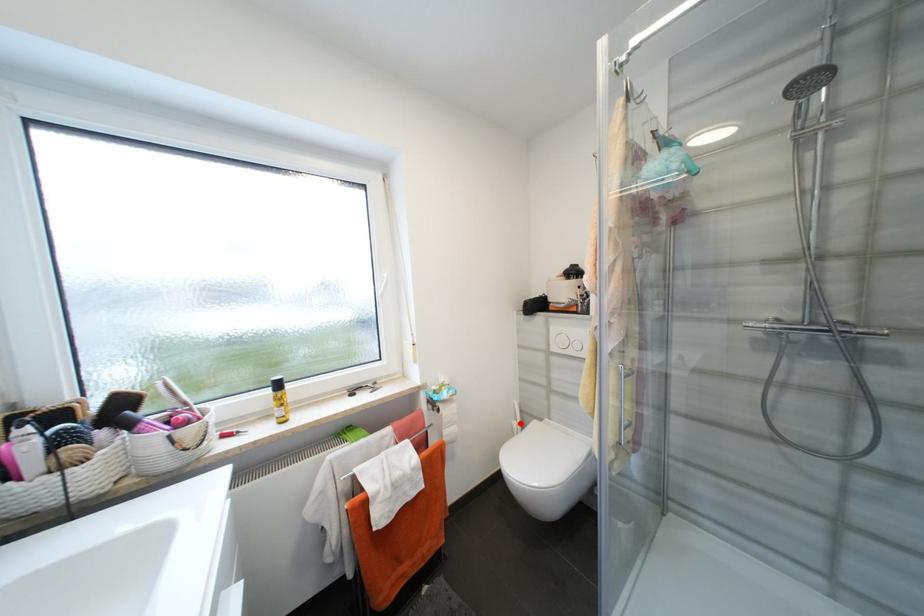
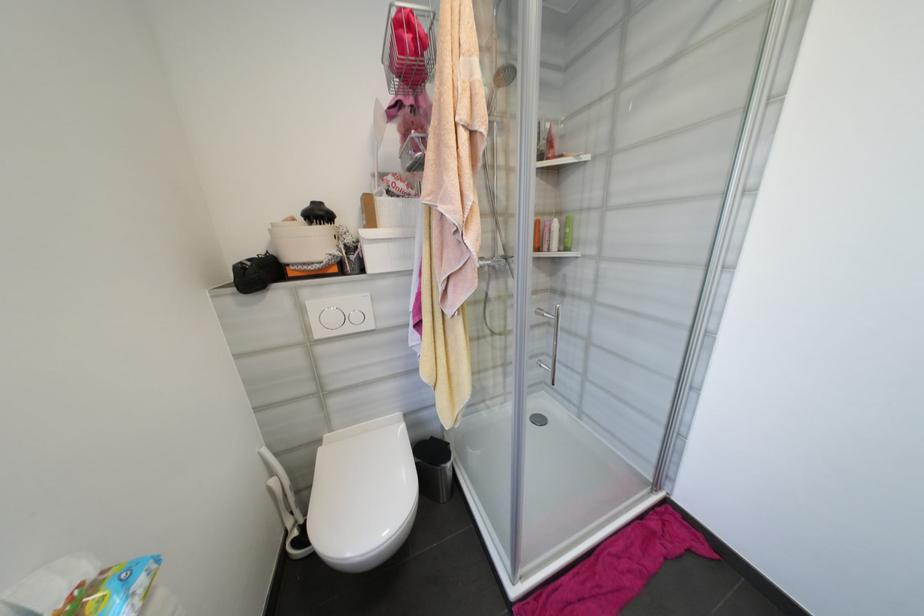
Question: I am providing you with two images of the same scene from different viewpoints. Image1 has a red point marked. In image2, the corresponding 3D location appears at what relative position? Reply with the corresponding letter.

Choices:
 (A) Closer
 (B) Farther

Answer: (A)